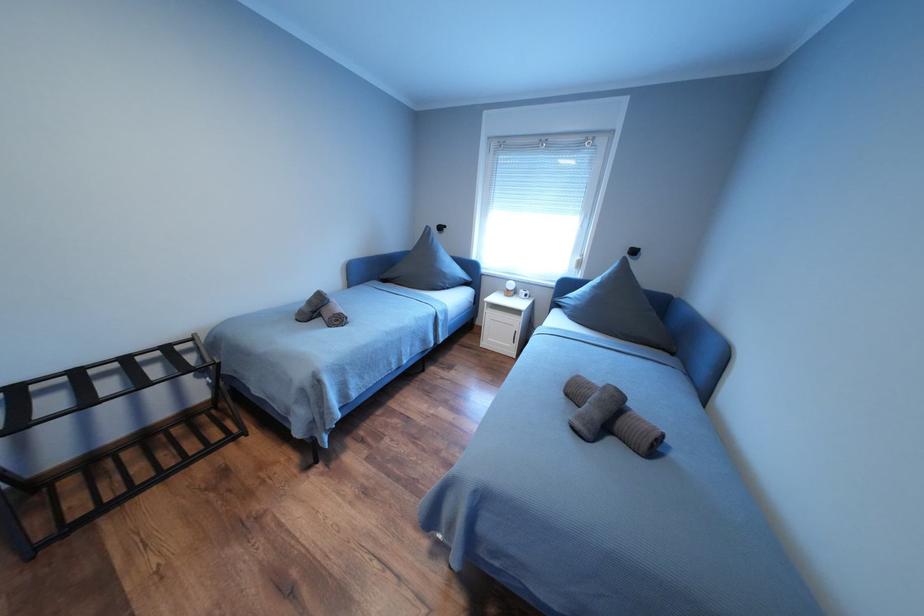
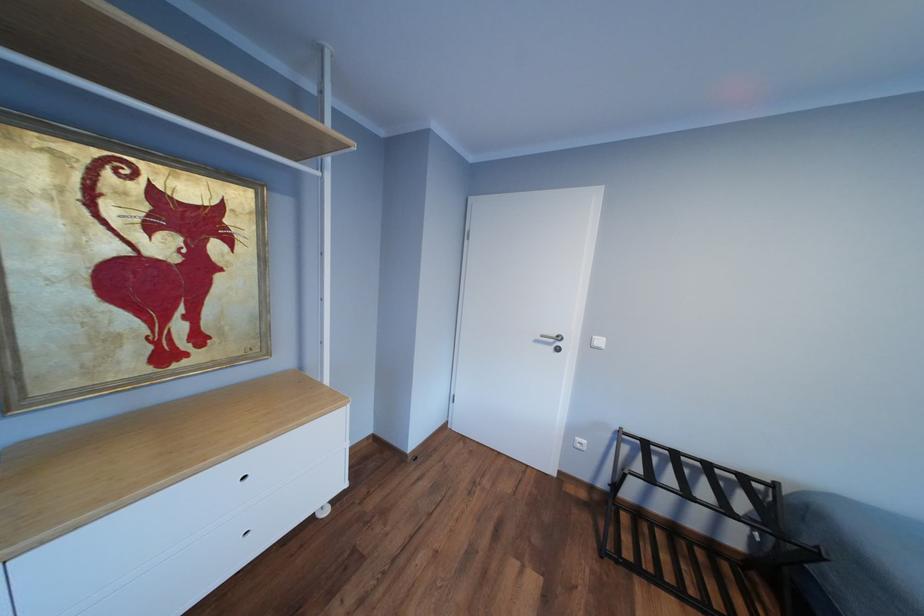
Question: The images are taken continuously from a first-person perspective. In which direction is your viewpoint rotating?

Choices:
 (A) Left
 (B) Right
 (C) Up
 (D) Down

Answer: (A)